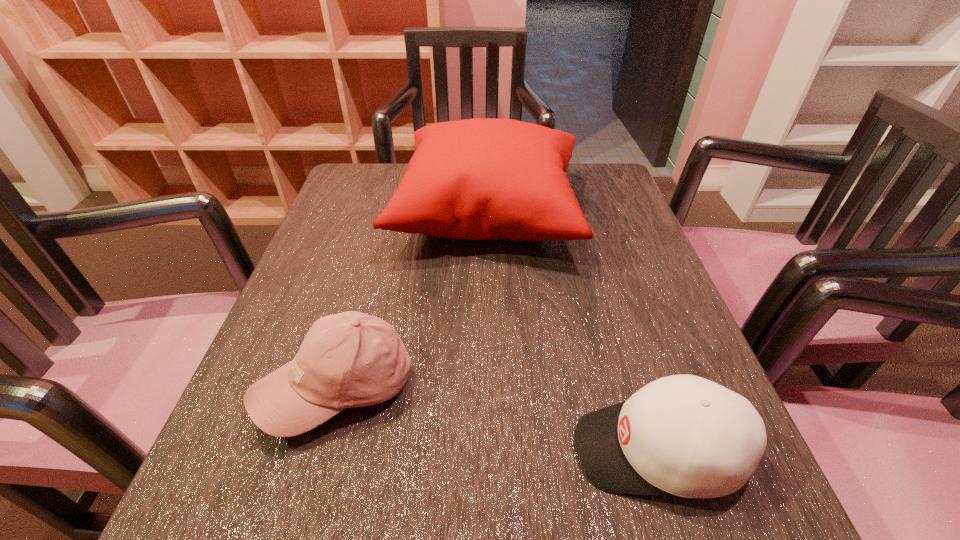
Where is `object that is at the near edge`? This screenshot has width=960, height=540. object that is at the near edge is located at coordinates (682, 435).

Find the location of `cushion that is at the left edge`. cushion that is at the left edge is located at coordinates (475, 179).

This screenshot has width=960, height=540. In order to click on baseball cap located in the left edge section of the desktop in this screenshot , I will do `click(351, 359)`.

You are a GUI agent. You are given a task and a screenshot of the screen. Output one action in this format:
    pyautogui.click(x=<x>, y=<y>)
    Task: Click on the cushion that is positioned at the right edge
    The height and width of the screenshot is (540, 960).
    Given the screenshot: What is the action you would take?
    pyautogui.click(x=475, y=179)

Image resolution: width=960 pixels, height=540 pixels. In order to click on baseball cap that is positioned at the right edge in this screenshot , I will do `click(682, 435)`.

Identify the location of object that is at the far left corner. This screenshot has width=960, height=540. (475, 179).

The height and width of the screenshot is (540, 960). In order to click on object situated at the far right corner in this screenshot , I will do `click(475, 179)`.

Find the location of a particular element. object that is at the near right corner is located at coordinates (682, 435).

In the image, there is a desktop. Where is `free space at the near edge`? Image resolution: width=960 pixels, height=540 pixels. free space at the near edge is located at coordinates (382, 528).

Locate an element on the screen. free space at the left edge of the desktop is located at coordinates (323, 276).